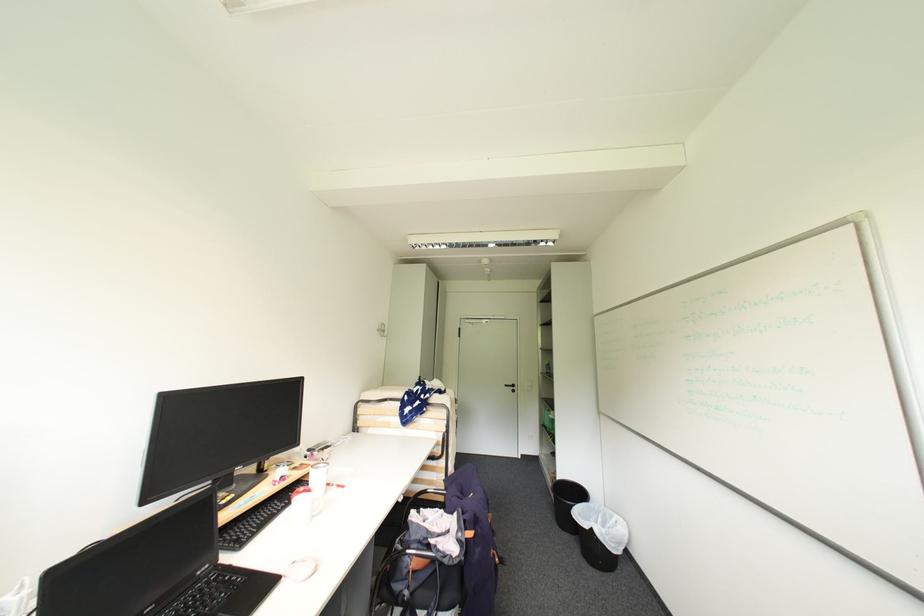
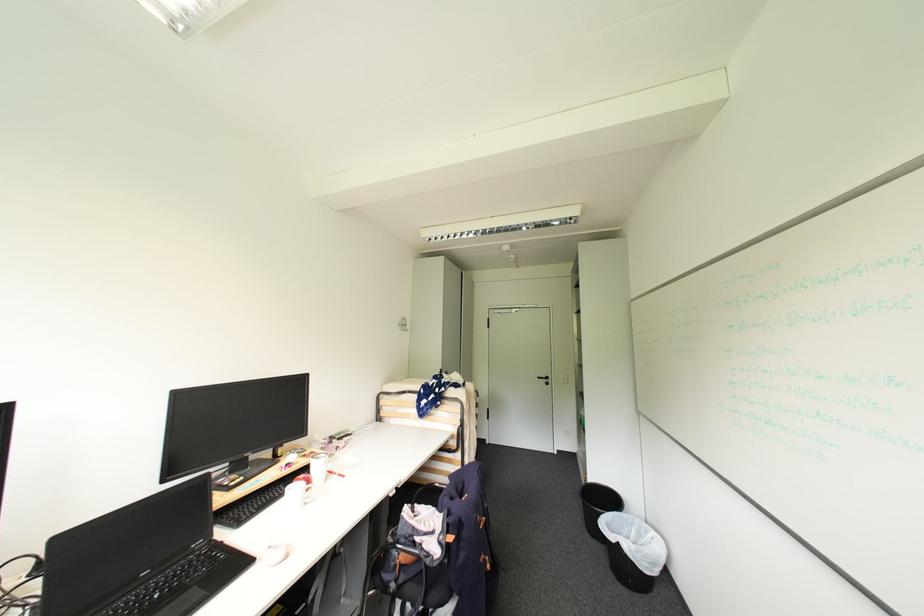
In the second image, find the point that corresponds to (x=384, y=331) in the first image.

(406, 325)